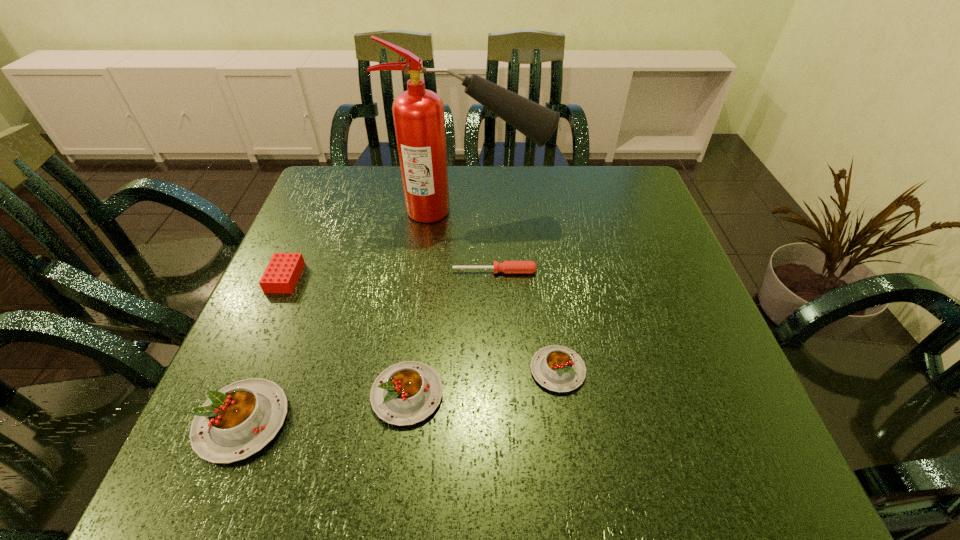
I want to click on free region located 0.350m on the back of the second tallest pudding, so click(427, 241).

You are a GUI agent. You are given a task and a screenshot of the screen. Output one action in this format:
    pyautogui.click(x=<x>, y=<y>)
    Task: Click on the free space located 0.170m on the left of the shortest pudding
    This screenshot has width=960, height=540.
    Given the screenshot: What is the action you would take?
    pyautogui.click(x=437, y=370)

Find the location of `free space located 0.080m at the nozzle of the farthest object`. free space located 0.080m at the nozzle of the farthest object is located at coordinates (578, 211).

The width and height of the screenshot is (960, 540). I want to click on vacant space located 0.250m on the front of the Lego, so click(231, 400).

Where is `free space located 0.210m on the right of the shortest object`? The height and width of the screenshot is (540, 960). free space located 0.210m on the right of the shortest object is located at coordinates (631, 272).

At what (x,y) coordinates should I click in order to perform the action: click on object situated at the far edge. Please return your answer as a coordinate pair (x, y). Image resolution: width=960 pixels, height=540 pixels. Looking at the image, I should click on (419, 121).

Image resolution: width=960 pixels, height=540 pixels. Find the location of `pudding at the left edge`. pudding at the left edge is located at coordinates click(237, 421).

Locate an element on the screen. Lego positioned at the left edge is located at coordinates (283, 271).

Identify the location of object at the near left corner. The image size is (960, 540). (237, 421).

You are a GUI agent. You are given a task and a screenshot of the screen. Output one action in this format:
    pyautogui.click(x=<x>, y=<y>)
    Task: Click on the free space at the far edge of the desktop
    
    Given the screenshot: What is the action you would take?
    pyautogui.click(x=406, y=207)